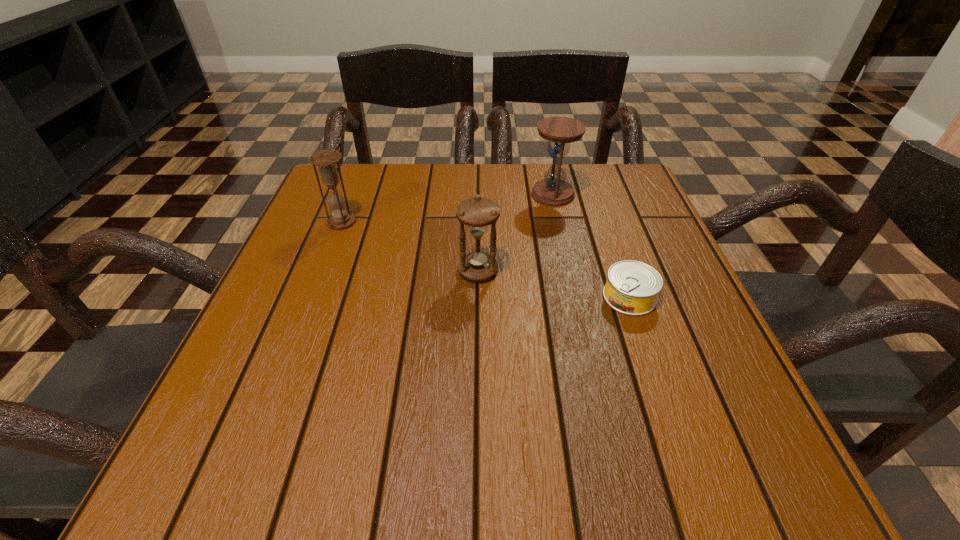
Identify the location of free space located on the left of the can. The height and width of the screenshot is (540, 960). (482, 297).

Where is `object present at the left edge`? object present at the left edge is located at coordinates (326, 160).

The height and width of the screenshot is (540, 960). Find the location of `object situated at the right edge`. object situated at the right edge is located at coordinates (632, 287).

Where is `object present at the far left corner`? object present at the far left corner is located at coordinates (326, 160).

In the image, there is a desktop. Where is `vacant area at the far edge`? The image size is (960, 540). vacant area at the far edge is located at coordinates (406, 206).

In the image, there is a desktop. Identify the location of vacant space at the near edge. (333, 461).

Locate an element on the screen. This screenshot has width=960, height=540. free spot at the left edge of the desktop is located at coordinates (355, 221).

Locate an element on the screen. blank space at the right edge of the desktop is located at coordinates (687, 300).

In the image, there is a desktop. Identify the location of vacant space at the near left corner. (269, 468).

This screenshot has width=960, height=540. Identify the location of vacant region at the far right corner of the desktop. (634, 199).